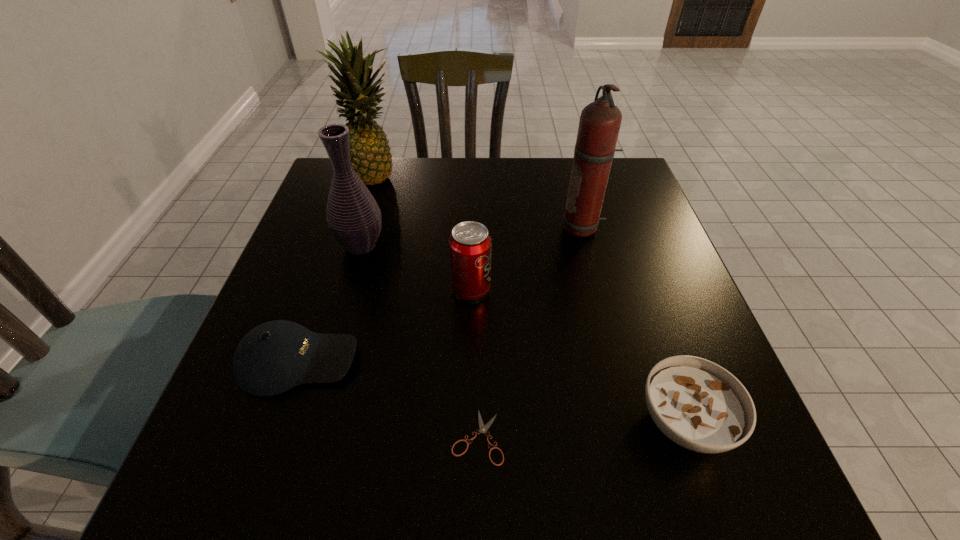
At what (x,y) coordinates should I click in order to perform the action: click on free spot at the right edge of the desktop. Please return your answer as a coordinate pair (x, y). Looking at the image, I should click on (656, 220).

Where is `free region at the near left corner of the desktop`? The height and width of the screenshot is (540, 960). free region at the near left corner of the desktop is located at coordinates (202, 475).

Find the location of a particular element. free region at the near right corner is located at coordinates (723, 467).

Where is `empty location between the third tallest object and the shears`? empty location between the third tallest object and the shears is located at coordinates (420, 341).

Identify the location of vacant area that lies between the vase and the shortest object. The image size is (960, 540). (420, 341).

At what (x,y) coordinates should I click in order to perform the action: click on free spot between the fire extinguisher and the shortest object. Please return your answer as a coordinate pair (x, y). The width and height of the screenshot is (960, 540). Looking at the image, I should click on (530, 333).

Where is `vacant point located between the vase and the baseball cap`? vacant point located between the vase and the baseball cap is located at coordinates (330, 303).

Identify the location of empty space between the fire extinguisher and the baseball cap. Image resolution: width=960 pixels, height=540 pixels. (441, 294).

This screenshot has width=960, height=540. Identify the location of free space between the fourth tallest object and the fire extinguisher. [527, 259].

Find the location of a particular element. This screenshot has height=540, width=960. free area in between the fourth farthest object and the third tallest object is located at coordinates (416, 267).